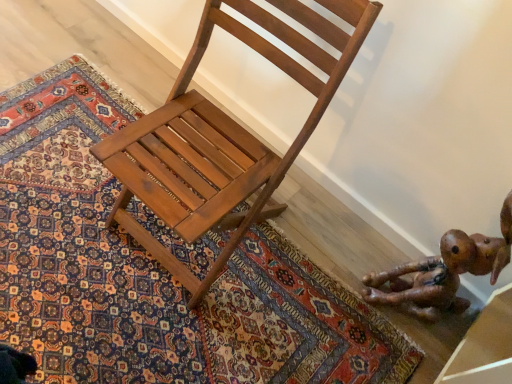
The image size is (512, 384). Describe the element at coordinates (154, 272) in the screenshot. I see `carpeted rug at center` at that location.

This screenshot has height=384, width=512. Find the location of `shiny brown wood chair at center`. shiny brown wood chair at center is located at coordinates (224, 135).

From the image's perspective, would you say brown leather toy at lower right is shown under carpeted rug at center?

Yes.

Does brown leather toy at lower right have a smaller size compared to carpeted rug at center?

Actually, brown leather toy at lower right might be larger than carpeted rug at center.

At what (x,y) coordinates should I click in order to perform the action: click on mat that is under the brown leather toy at lower right (from a real-world perspective). Please return your answer as a coordinate pair (x, y). Looking at the image, I should click on (154, 272).

Is point (469, 263) farther from viewer compared to point (384, 358)?

No.

Between shiny brown wood chair at center and carpeted rug at center, which one appears on the right side from the viewer's perspective?

Positioned to the right is shiny brown wood chair at center.

Is shiny brown wood chair at center positioned beyond the bounds of carpeted rug at center?

shiny brown wood chair at center is positioned outside carpeted rug at center.

From a real-world perspective, is shiny brown wood chair at center located higher than carpeted rug at center?

Yes.

Which object is closer to the camera, shiny brown wood chair at center or carpeted rug at center?

Positioned in front is shiny brown wood chair at center.

Considering the relative sizes of carpeted rug at center and shiny brown wood chair at center in the image provided, is carpeted rug at center smaller than shiny brown wood chair at center?

Indeed, carpeted rug at center has a smaller size compared to shiny brown wood chair at center.

This screenshot has width=512, height=384. Find the location of `chair lying above the carpeted rug at center (from the image's perspective)`. chair lying above the carpeted rug at center (from the image's perspective) is located at coordinates (224, 135).

From the image's perspective, is carpeted rug at center under shiny brown wood chair at center?

Yes, from the image's perspective, carpeted rug at center is below shiny brown wood chair at center.

Does carpeted rug at center have a greater width compared to shiny brown wood chair at center?

Yes.

Considering the sizes of objects carpeted rug at center and brown leather toy at lower right in the image provided, who is bigger, carpeted rug at center or brown leather toy at lower right?

brown leather toy at lower right is bigger.

Image resolution: width=512 pixels, height=384 pixels. I want to click on mat lying behind the brown leather toy at lower right, so [154, 272].

Is carpeted rug at center facing away from brown leather toy at lower right?

No.

Is brown leather toy at lower right with shiny brown wood chair at center?

No, brown leather toy at lower right is not beside shiny brown wood chair at center.

From the image's perspective, who appears lower, brown leather toy at lower right or shiny brown wood chair at center?

brown leather toy at lower right appears lower in the image.

Does brown leather toy at lower right contain shiny brown wood chair at center?

Answer: No, shiny brown wood chair at center is located outside of brown leather toy at lower right.

Measure the distance from brown leather toy at lower right to shiny brown wood chair at center.

brown leather toy at lower right is 25.02 inches from shiny brown wood chair at center.

From their relative heights in the image, would you say shiny brown wood chair at center is taller or shorter than brown leather toy at lower right?

Considering their sizes, shiny brown wood chair at center has more height than brown leather toy at lower right.

Is shiny brown wood chair at center further to camera compared to brown leather toy at lower right?

No, the depth of shiny brown wood chair at center is less than that of brown leather toy at lower right.

You are a GUI agent. You are given a task and a screenshot of the screen. Output one action in this format:
    pyautogui.click(x=<x>, y=<y>)
    Task: Click on the chair lying on the left of brown leather toy at lower right
    
    Given the screenshot: What is the action you would take?
    tap(224, 135)

Considering the relative positions of shiny brown wood chair at center and brown leather toy at lower right in the image provided, is shiny brown wood chair at center to the left or to the right of brown leather toy at lower right?

shiny brown wood chair at center is positioned on brown leather toy at lower right's left side.

Locate an element on the screen. This screenshot has height=384, width=512. mat on the left of the brown leather toy at lower right is located at coordinates (154, 272).

Locate an element on the screen. mat below the shiny brown wood chair at center (from the image's perspective) is located at coordinates (154, 272).

From the image, which object appears to be farther from carpeted rug at center, shiny brown wood chair at center or brown leather toy at lower right?

brown leather toy at lower right.

From the picture: Estimate the real-world distances between objects in this image. Which object is closer to brown leather toy at lower right, carpeted rug at center or shiny brown wood chair at center?

carpeted rug at center lies closer to brown leather toy at lower right than the other object.

When comparing their distances from carpeted rug at center, does brown leather toy at lower right or shiny brown wood chair at center seem closer?

The object closer to carpeted rug at center is shiny brown wood chair at center.

From the image, which object appears to be nearer to brown leather toy at lower right, shiny brown wood chair at center or carpeted rug at center?

carpeted rug at center.

Which object lies nearer to the anchor point shiny brown wood chair at center, carpeted rug at center or brown leather toy at lower right?

carpeted rug at center is closer to shiny brown wood chair at center.

Considering their positions, is brown leather toy at lower right positioned further to shiny brown wood chair at center than carpeted rug at center?

Based on the image, brown leather toy at lower right appears to be further to shiny brown wood chair at center.

Where is `chair situated between carpeted rug at center and brown leather toy at lower right from left to right`? Image resolution: width=512 pixels, height=384 pixels. chair situated between carpeted rug at center and brown leather toy at lower right from left to right is located at coordinates (224, 135).